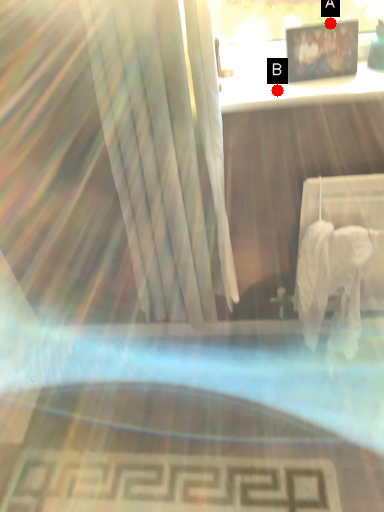
Question: Two points are circled on the image, labeled by A and B beside each circle. Among these points, which one is nearest to the camera?

Choices:
 (A) A is closer
 (B) B is closer

Answer: (B)